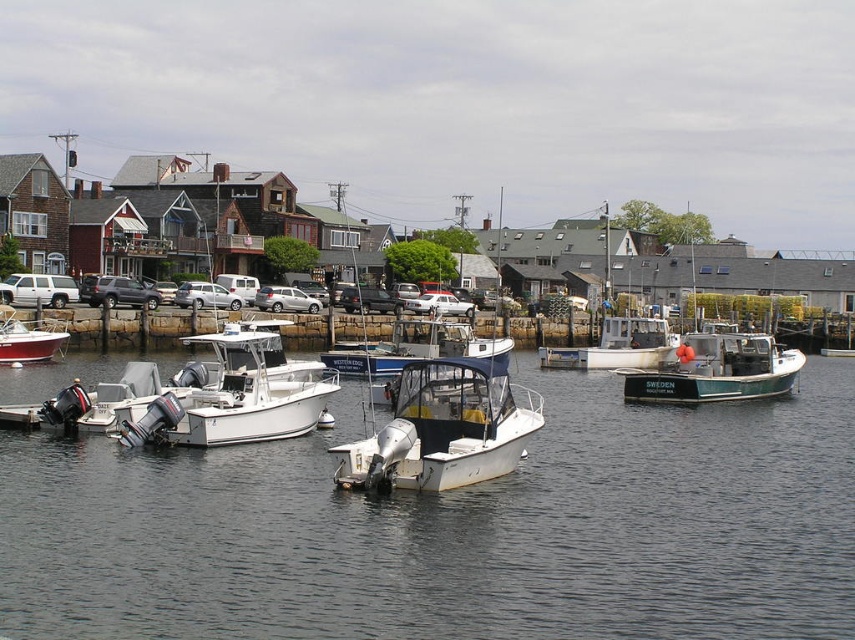
Who is taller, white matte motorboat at left or teal matte fishing boat at center-right?

white matte motorboat at left is taller.

Where is `white matte motorboat at left`? This screenshot has width=855, height=640. white matte motorboat at left is located at coordinates (233, 396).

Is point (60, 588) farther from camera compared to point (254, 412)?

That is False.

Does white matte water at center appear on the left side of white matte motorboat at left?

Incorrect, white matte water at center is not on the left side of white matte motorboat at left.

Is point (55, 612) closer to viewer compared to point (215, 440)?

Yes, it is.

You are a GUI agent. You are given a task and a screenshot of the screen. Output one action in this format:
    pyautogui.click(x=<x>, y=<y>)
    Task: Click on the white matte water at center
    
    Given the screenshot: What is the action you would take?
    pyautogui.click(x=452, y=529)

Is the position of white matte boat at center less distant than that of white matte motorboat at left?

Yes.

What do you see at coordinates (443, 428) in the screenshot? I see `white matte boat at center` at bounding box center [443, 428].

Is point (513, 456) more distant than point (237, 362)?

No, it is not.

This screenshot has width=855, height=640. In order to click on white matte boat at center in this screenshot , I will do `click(443, 428)`.